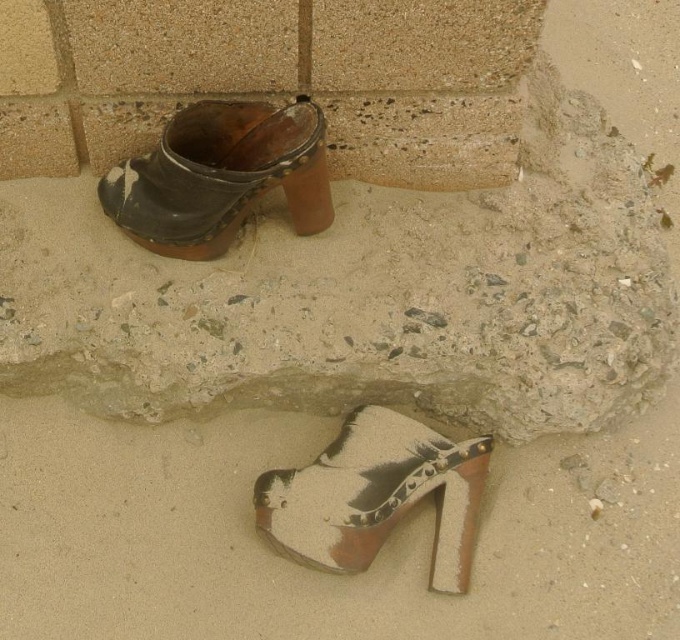
Question: Does shiny metallic sandal at lower center appear on the left side of leather/cracked shoe at upper left?

Choices:
 (A) no
 (B) yes

Answer: (A)

Question: Which point is closer to the camera?

Choices:
 (A) (469, 568)
 (B) (307, 156)

Answer: (B)

Question: Which of the following is the farthest from the observer?

Choices:
 (A) shiny metallic sandal at lower center
 (B) leather/cracked shoe at upper left

Answer: (A)

Question: Is shiny metallic sandal at lower center to the left of leather/cracked shoe at upper left from the viewer's perspective?

Choices:
 (A) yes
 (B) no

Answer: (B)

Question: Is shiny metallic sandal at lower center smaller than leather/cracked shoe at upper left?

Choices:
 (A) no
 (B) yes

Answer: (B)